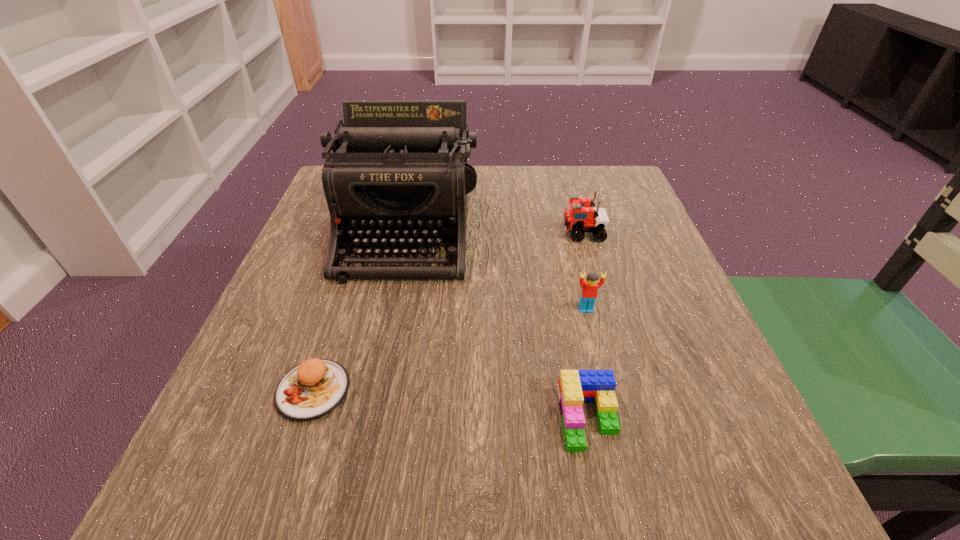
Locate an element on the screen. This screenshot has width=960, height=540. the tallest object is located at coordinates (399, 173).

I want to click on the farthest Lego, so click(581, 216).

Find the location of a particular element. the third nearest object is located at coordinates coord(589,291).

This screenshot has width=960, height=540. What are the coordinates of `patty` in the screenshot? It's located at (312, 389).

This screenshot has height=540, width=960. I want to click on the nearest Lego, so click(x=575, y=387).

The width and height of the screenshot is (960, 540). What are the coordinates of `free space located 0.170m on the keyboard of the typewriter` in the screenshot? It's located at (379, 357).

Locate an element on the screen. This screenshot has width=960, height=540. free point located on the front-facing side of the farthest Lego is located at coordinates (447, 233).

You are a GUI agent. You are given a task and a screenshot of the screen. Output one action in this format:
    pyautogui.click(x=<x>, y=<y>)
    Task: Click on the vacant space positioned on the front-facing side of the farthest Lego
    This screenshot has height=540, width=960.
    Given the screenshot: What is the action you would take?
    pyautogui.click(x=466, y=233)

Locate an element on the screen. The image size is (960, 540). vacant space located 0.210m on the front-facing side of the farthest Lego is located at coordinates (466, 233).

Locate an element on the screen. Image resolution: width=960 pixels, height=540 pixels. free space located on the face of the second farthest Lego is located at coordinates (599, 363).